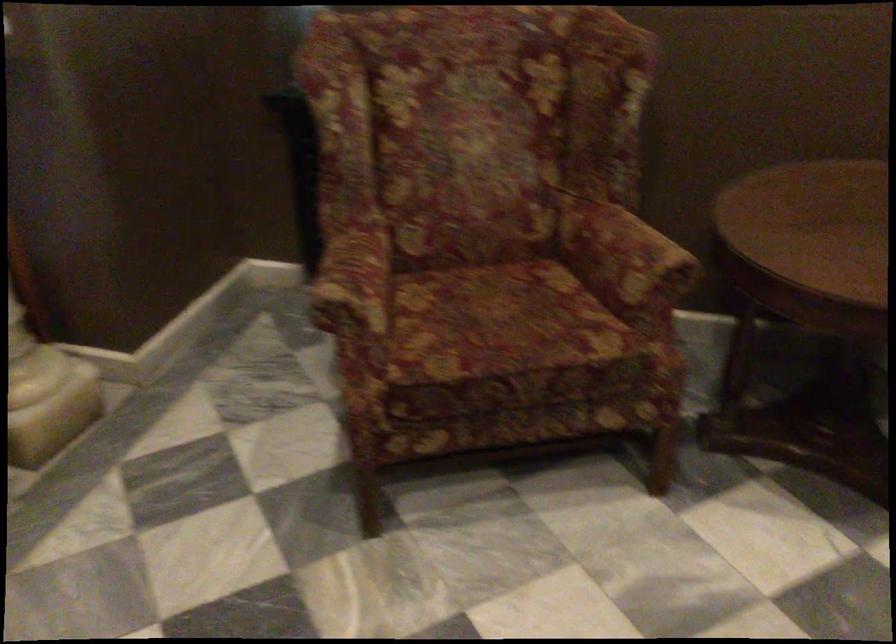
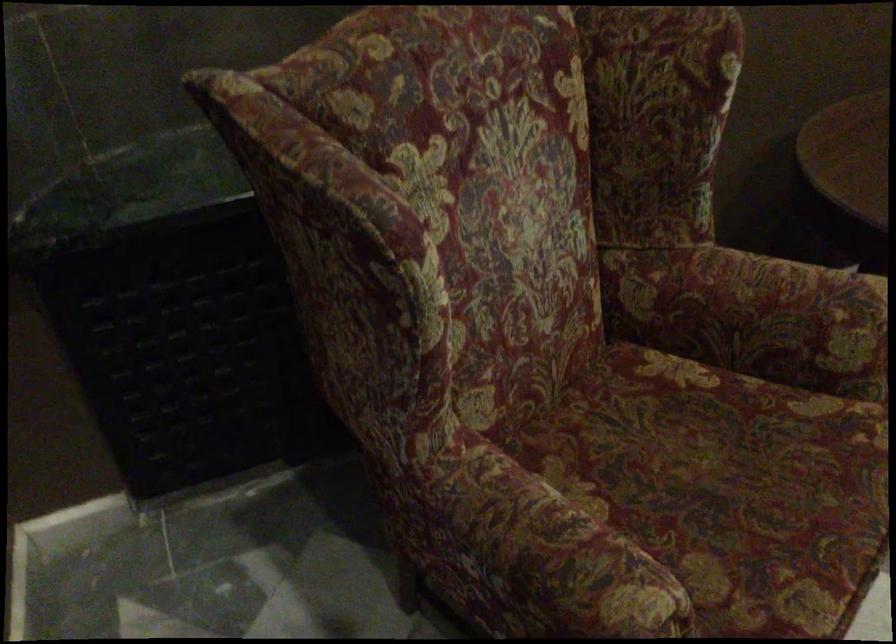
In the second image, find the point that corresponds to point (488, 319) in the first image.

(726, 486)